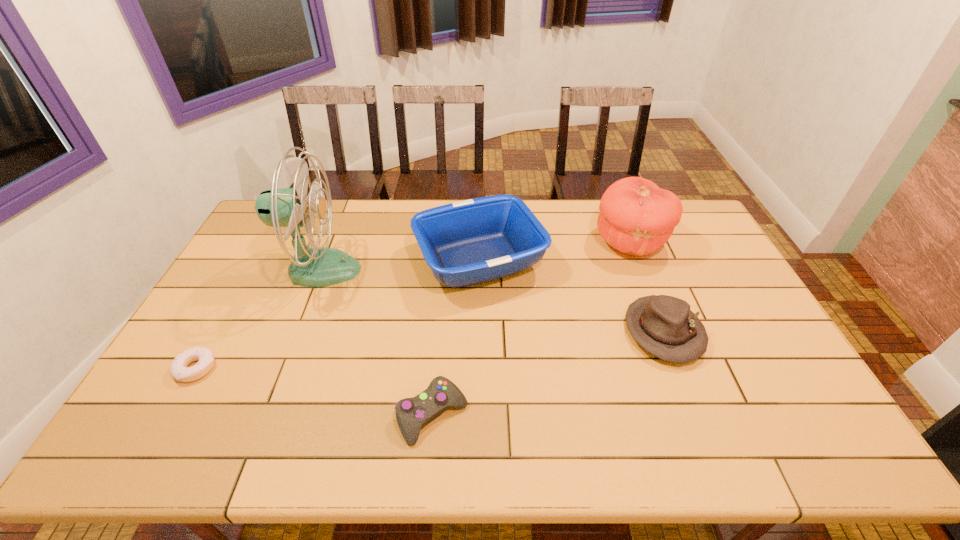
Identify the location of fan. This screenshot has height=540, width=960. (314, 266).

Find the location of a particular element. Image resolution: width=960 pixels, height=540 pixels. the second object from left to right is located at coordinates (314, 266).

At what (x,y) coordinates should I click in order to perform the action: click on pumpkin. Please return your answer as a coordinate pair (x, y). Looking at the image, I should click on (x=636, y=217).

Identify the location of tray. 473,241.

This screenshot has width=960, height=540. I want to click on hat, so click(x=664, y=326).

Find the location of `the nearest object`. the nearest object is located at coordinates (412, 414).

Identify the location of control. This screenshot has width=960, height=540. (412, 414).

At what (x,y) coordinates should I click in order to perform the action: click on the leftmost object. Please return your answer as a coordinate pair (x, y). Image resolution: width=960 pixels, height=540 pixels. Looking at the image, I should click on (204, 356).

Where is `the shortest object`? The height and width of the screenshot is (540, 960). the shortest object is located at coordinates (204, 356).

Find the location of a particular element. free space located 0.120m in front of the second object from left to right, directing airflow is located at coordinates (396, 270).